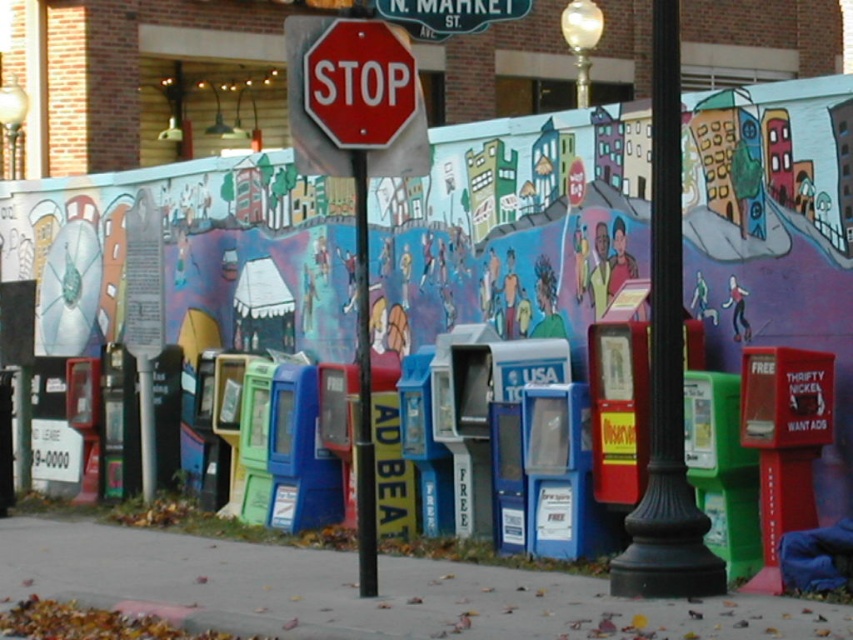
Is point (650, 467) farther from camera compared to point (328, 42)?

No.

Can you confirm if black polished pole at center is positioned above red matte stop sign at center?

No, black polished pole at center is not above red matte stop sign at center.

Is point (669, 22) positioned behind point (340, 93)?

No, (669, 22) is closer to viewer.

The height and width of the screenshot is (640, 853). I want to click on black polished pole at center, so click(x=666, y=368).

Does point (91, 525) come farther from viewer compared to point (340, 96)?

Yes, it is.

The height and width of the screenshot is (640, 853). Identify the location of gray concrete sidewalk at center. (364, 598).

Which is more to the left, black polished pole at center or red stop sign at upper center?

From the viewer's perspective, red stop sign at upper center appears more on the left side.

What are the coordinates of `black polished pole at center` in the screenshot? It's located at (666, 368).